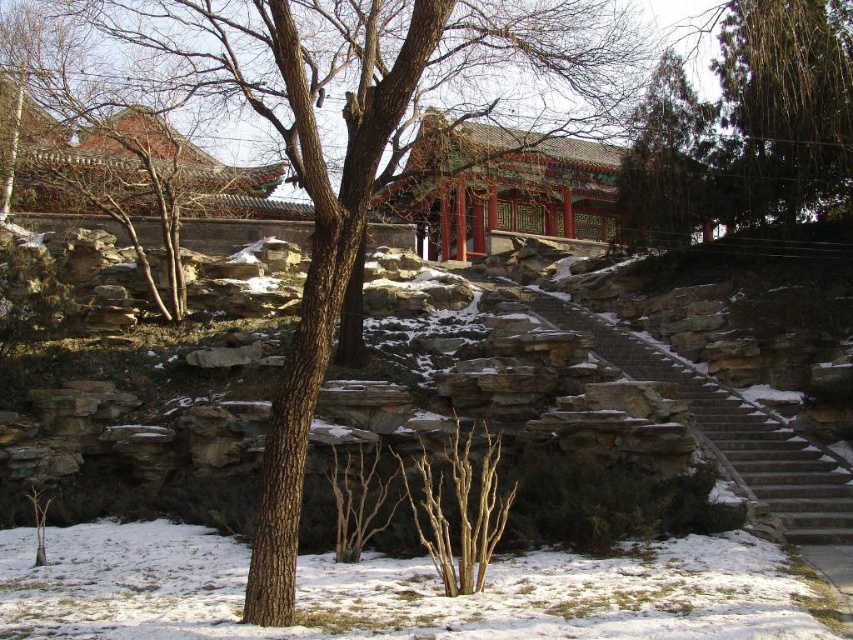
You are standing at the base of the stone steps leading to the traditional Chinese building. You notice two points marked in the scene. The first point is located at coordinates point (830, 19), and the second is at point (463, 524). From your current position, which point is closer to you?

Point (463, 524) is closer to you because it is in front of point (830, 19) according to the spatial relationship provided.